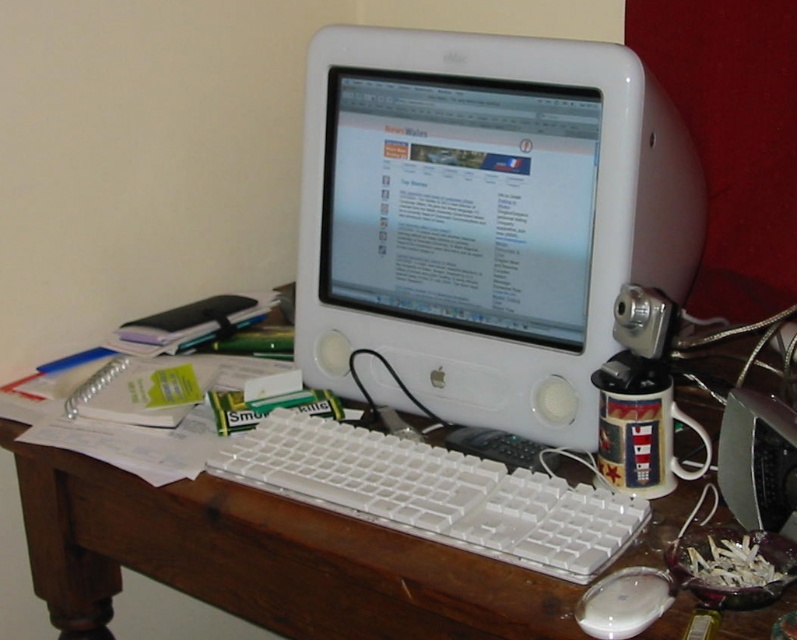
Question: Observing the image, what is the correct spatial positioning of white glossy monitor at center in reference to white glossy mouse at lower center?

Choices:
 (A) left
 (B) right

Answer: (A)

Question: Which object is closer to the camera taking this photo?

Choices:
 (A) white glossy mouse at lower center
 (B) white plastic keyboard at center

Answer: (A)

Question: Which is farther from the white plastic monitor at center?

Choices:
 (A) wooden desk at center
 (B) white plastic keyboard at center
 (C) white glossy monitor at center
 (D) white glossy mouse at lower center

Answer: (D)

Question: Is wooden desk at center in front of white plastic keyboard at center?

Choices:
 (A) no
 (B) yes

Answer: (B)

Question: Which of the following is the closest to the observer?

Choices:
 (A) (171, 506)
 (B) (599, 584)

Answer: (B)

Question: Is white plastic monitor at center bigger than white plastic keyboard at center?

Choices:
 (A) no
 (B) yes

Answer: (B)